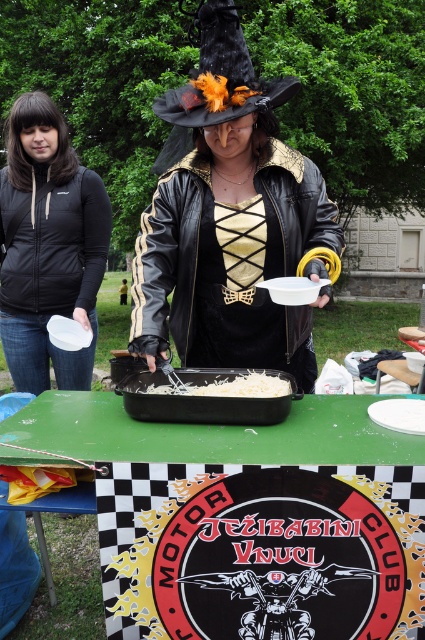
You are a food critic standing at the edge of the park. You see the green plastic table at center and the white shredded cheese at center. Which object is closer to the ground?

The green plastic table at center is closer to the ground because it is below the white shredded cheese at center.

What object is located at the coordinate point (53, 282) in the image?

The point (53, 282) corresponds to the black matte jacket at upper left.

You are a photographer trying to capture a closeup of the white shredded cheese at center without including the black matte jacket at upper left in the frame. Is it possible to do so based on their sizes?

The black matte jacket at upper left might be wider than white shredded cheese at center, so there is a possibility that the jacket could block the cheese if they are positioned in a way that the jacket is closer to the camera. However, without exact measurements, it is uncertain. The photographer should adjust the angle or position to ensure the cheese is framed properly.